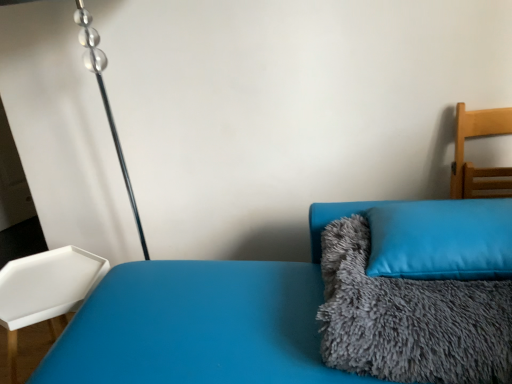
Question: Are light wood chair at right, arranged as the 2th furniture when viewed from the left, and white plastic tray at left, arranged as the second furniture when viewed from the top, making contact?

Choices:
 (A) yes
 (B) no

Answer: (B)

Question: Is light wood chair at right, arranged as the 2th furniture when viewed from the left, looking in the opposite direction of white plastic tray at left, arranged as the second furniture when viewed from the top?

Choices:
 (A) no
 (B) yes

Answer: (A)

Question: Is light wood chair at right, arranged as the 1th furniture when viewed from the top, taller than white plastic tray at left, arranged as the second furniture when viewed from the top?

Choices:
 (A) no
 (B) yes

Answer: (A)

Question: From the image's perspective, does light wood chair at right, the 1th furniture from the right, appear lower than white plastic tray at left, the 1th furniture when ordered from bottom to top?

Choices:
 (A) yes
 (B) no

Answer: (B)

Question: From a real-world perspective, is light wood chair at right, arranged as the 1th furniture when viewed from the top, located higher than white plastic tray at left, arranged as the second furniture when viewed from the top?

Choices:
 (A) no
 (B) yes

Answer: (B)

Question: Considering the positions of gray fluffy blanket at right and blue soft cushion at right in the image, is gray fluffy blanket at right taller or shorter than blue soft cushion at right?

Choices:
 (A) tall
 (B) short

Answer: (A)

Question: Is gray fluffy blanket at right to the left or to the right of blue soft cushion at right in the image?

Choices:
 (A) left
 (B) right

Answer: (A)

Question: Choose the correct answer: Is gray fluffy blanket at right inside blue soft cushion at right or outside it?

Choices:
 (A) outside
 (B) inside

Answer: (A)

Question: Is gray fluffy blanket at right wider or thinner than blue soft cushion at right?

Choices:
 (A) thin
 (B) wide

Answer: (B)

Question: Relative to blue fuzzy couch at center, is light wood chair at right, placed as the 2th furniture when sorted from bottom to top, in front or behind?

Choices:
 (A) front
 (B) behind

Answer: (B)

Question: From the image's perspective, is light wood chair at right, placed as the 2th furniture when sorted from bottom to top, positioned above or below blue fuzzy couch at center?

Choices:
 (A) below
 (B) above

Answer: (B)

Question: In terms of height, does light wood chair at right, the 1th furniture from the right, look taller or shorter compared to blue fuzzy couch at center?

Choices:
 (A) short
 (B) tall

Answer: (A)

Question: Based on their positions, is light wood chair at right, placed as the 2th furniture when sorted from bottom to top, located to the left or right of blue fuzzy couch at center?

Choices:
 (A) left
 (B) right

Answer: (B)

Question: Does point (466, 274) appear closer or farther from the camera than point (280, 344)?

Choices:
 (A) farther
 (B) closer

Answer: (B)

Question: From their relative heights in the image, would you say blue soft cushion at right is taller or shorter than blue fuzzy couch at center?

Choices:
 (A) short
 (B) tall

Answer: (A)